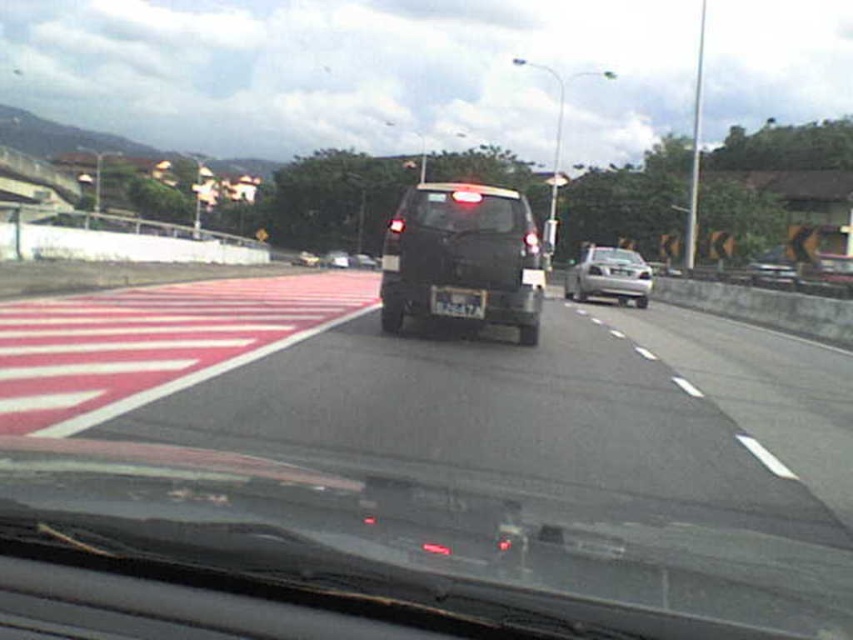
Who is taller, metallic silver sedan at right or black plastic license plate at center?

Standing taller between the two is metallic silver sedan at right.

The height and width of the screenshot is (640, 853). What are the coordinates of `metallic silver sedan at right` in the screenshot? It's located at (772, 268).

Does matte black suv at center have a lesser height compared to black matte windshield at center?

Incorrect, matte black suv at center's height does not fall short of black matte windshield at center's.

Which is in front, point (454, 246) or point (515, 225)?

Point (454, 246) is more forward.

Where is `matte black suv at center`? The width and height of the screenshot is (853, 640). matte black suv at center is located at coordinates [462, 259].

Between matte black suv at center and black plastic license plate at center, which one has less height?

With less height is black plastic license plate at center.

Is matte black suv at center taller than black plastic license plate at center?

Yes, matte black suv at center is taller than black plastic license plate at center.

Does point (421, 300) come in front of point (436, 305)?

No, it is behind (436, 305).

Locate an element on the screen. matte black suv at center is located at coordinates (462, 259).